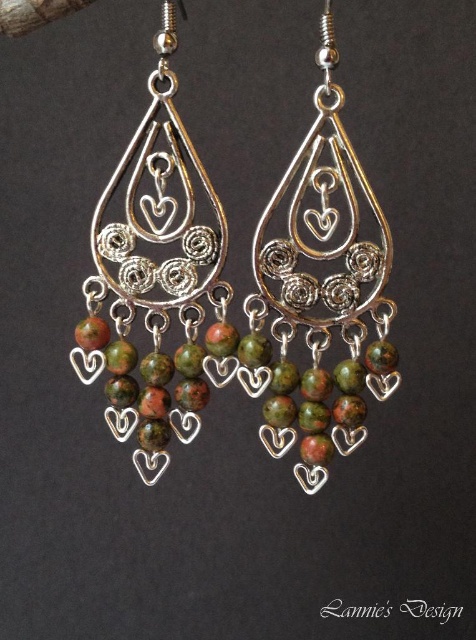
You are a jewelry designer trying to determine if the green marbled beads at center will fit within the green marble earrings at center. Given that the beads require at least 5 inches of space to be securely attached, can they be safely placed inside the earrings?

The distance between the green marbled beads at center and the green marble earrings at center is 5.17 inches, which exceeds the minimum required 5 inches. Therefore, the beads can be safely attached within the earrings.

You are a jeweler examining the earrings. You need to determine which part of the earrings is taller between the green marbled beads at center and the green marble earrings at center. Which one is taller?

The green marbled beads at center is taller than the green marble earrings at center according to the description provided.